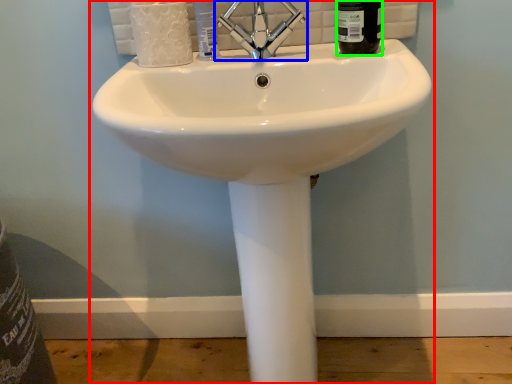
Question: Estimate the real-world distances between objects in this image. Which object is farther from sink (highlighted by a red box), tap (highlighted by a blue box) or liquid (highlighted by a green box)?

Choices:
 (A) tap
 (B) liquid

Answer: (B)